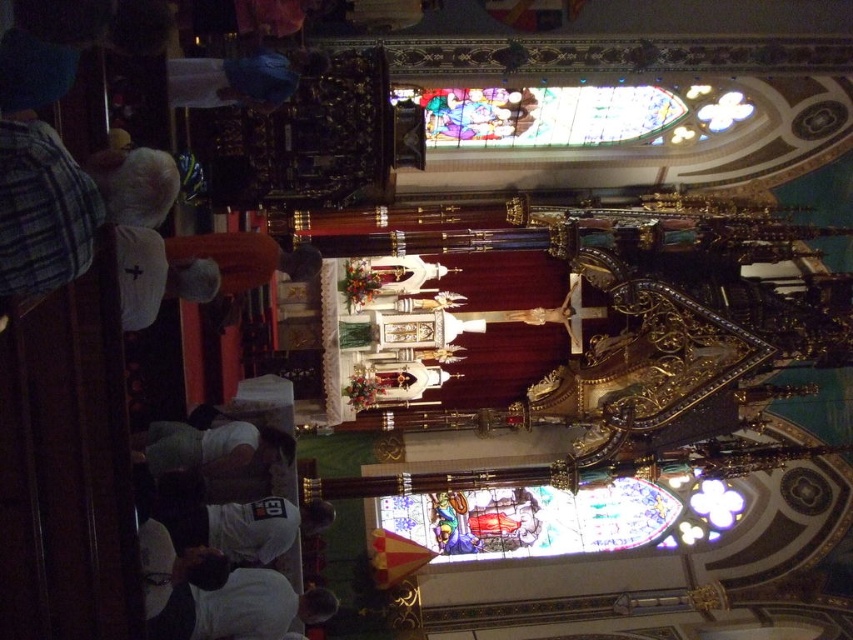
Is stained glass at upper center taller than white fabric at left?

Yes.

Does stained glass at upper center have a greater width compared to white fabric at left?

Correct, the width of stained glass at upper center exceeds that of white fabric at left.

Is point (505, 108) positioned behind point (207, 252)?

That is True.

Identify the location of stained glass at upper center. (570, 115).

Is white fabric at left wider than white porcelain statue at center?

Correct, the width of white fabric at left exceeds that of white porcelain statue at center.

Can you confirm if white fabric at left is positioned below white porcelain statue at center?

Yes, white fabric at left is below white porcelain statue at center.

Image resolution: width=853 pixels, height=640 pixels. Identify the location of white fabric at left. (196, 268).

Is point (518, 500) positioned before point (218, 444)?

No, it is behind (218, 444).

Looking at this image, does stained glass window at center appear over white fabric at lower center?

No.

Where is `stained glass window at center`? The width and height of the screenshot is (853, 640). stained glass window at center is located at coordinates (563, 516).